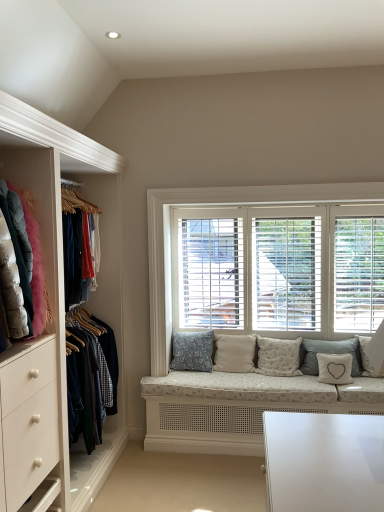
Question: Looking at their shapes, would you say light gray fabric pillow at center, the fifth pillow in the left-to-right sequence, is wider or thinner than white wood blinds at center?

Choices:
 (A) thin
 (B) wide

Answer: (B)

Question: From a real-world perspective, is light gray fabric pillow at center, the fifth pillow in the left-to-right sequence, physically located above or below white wood blinds at center?

Choices:
 (A) above
 (B) below

Answer: (B)

Question: Based on their relative distances, which object is nearer to the fluffy white pillow at center, which is counted as the 3th pillow, starting from the left?

Choices:
 (A) light gray fabric pillow at center, the fifth pillow in the left-to-right sequence
 (B) white fabric pillow with heart design at lower right, which ranks as the fourth pillow in left-to-right order
 (C) blue textured cushion at center, marked as the sixth pillow in a right-to-left arrangement
 (D) velvet jackets at left
 (E) beige fabric cushion at center, which is the fifth pillow from right to left

Answer: (E)

Question: Which object is positioned farthest from the fluffy white pillow at center, which appears as the sixth pillow when viewed from the left?

Choices:
 (A) fluffy white pillow at center, which is counted as the 3th pillow, starting from the left
 (B) blue textured cushion at center, marked as the sixth pillow in a right-to-left arrangement
 (C) light gray fabric pillow at center, the fifth pillow in the left-to-right sequence
 (D) white wood blinds at center
 (E) beige fabric cushion at center, which is the fifth pillow from right to left

Answer: (D)